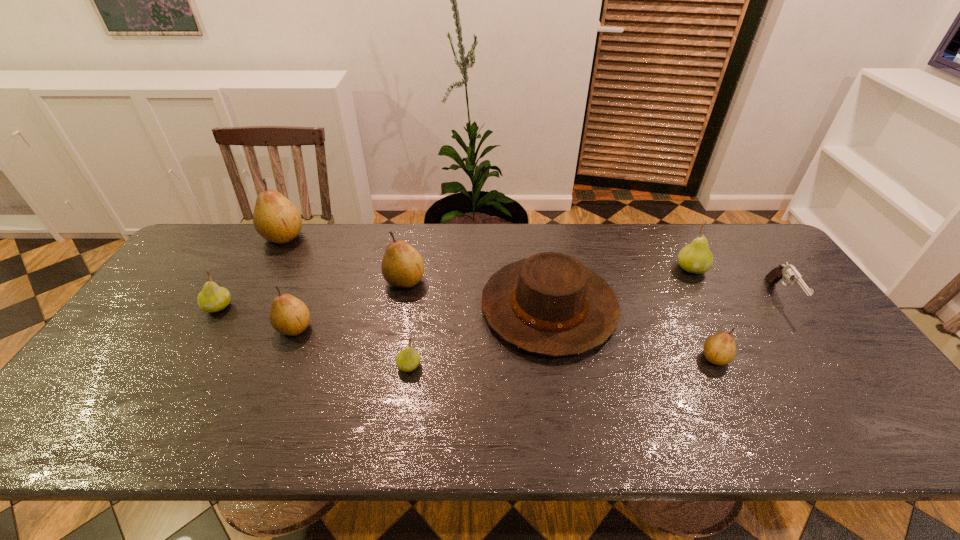
The width and height of the screenshot is (960, 540). Identify the location of the leftmost brown pear. (275, 218).

Locate an element on the screen. This screenshot has height=540, width=960. the farthest object is located at coordinates 275,218.

Identify the location of the rightmost green pear. This screenshot has height=540, width=960. (696, 257).

The width and height of the screenshot is (960, 540). I want to click on the biggest green pear, so click(696, 257).

Locate an element on the screen. This screenshot has height=540, width=960. the third brown pear from left to right is located at coordinates (402, 266).

The height and width of the screenshot is (540, 960). What are the coordinates of `the third nearest brown pear` in the screenshot? It's located at (402, 266).

Where is `the fourth object from right to left`? The image size is (960, 540). the fourth object from right to left is located at coordinates (549, 304).

Find the location of a particular element. This screenshot has width=960, height=540. the second farthest green pear is located at coordinates (212, 298).

In order to click on the second smallest green pear in this screenshot , I will do `click(212, 298)`.

Where is `the second smallest brown pear`? Image resolution: width=960 pixels, height=540 pixels. the second smallest brown pear is located at coordinates (290, 316).